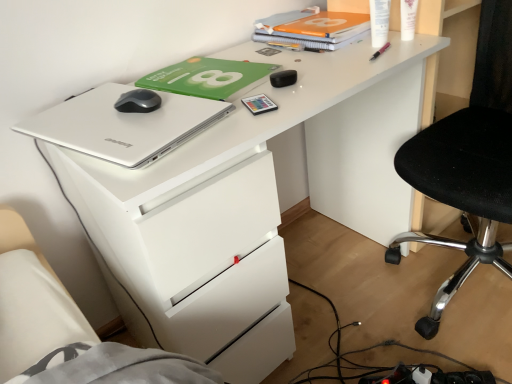
Identify the location of free space between orange matte notebook at upper center and matte plastic card at center, acting as the fifth stationery starting from the top. (291, 62).